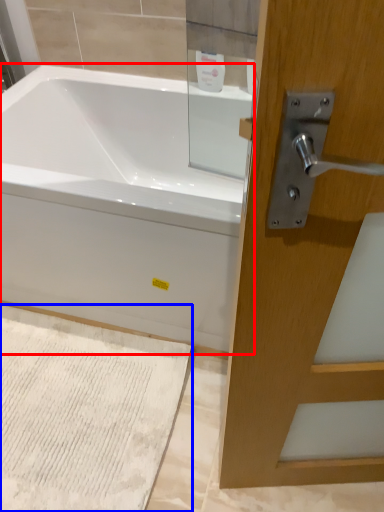
Question: Which point is further to the camera, bathtub (highlighted by a red box) or bath mat (highlighted by a blue box)?

Choices:
 (A) bathtub
 (B) bath mat

Answer: (B)